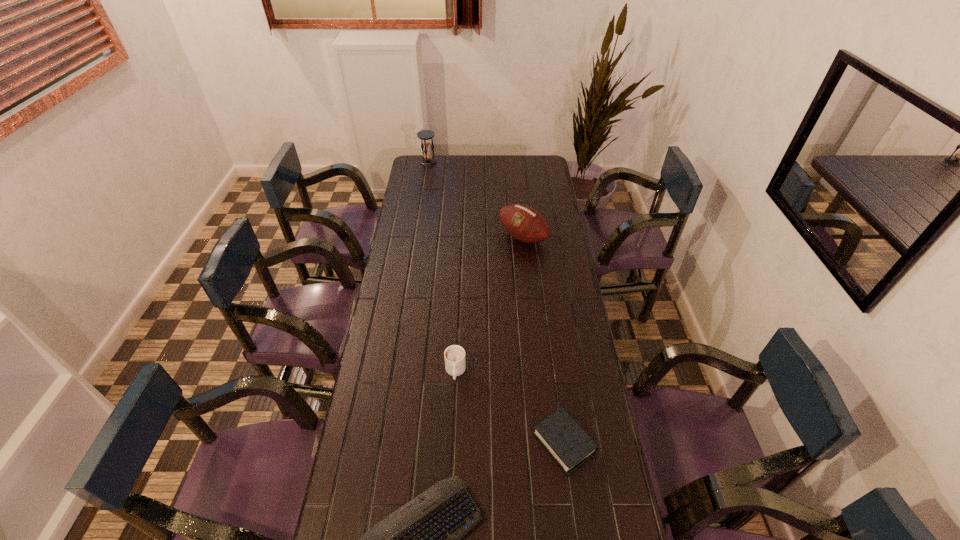
Where is `object located at the left edge`? The image size is (960, 540). object located at the left edge is located at coordinates (425, 135).

Image resolution: width=960 pixels, height=540 pixels. Identify the location of football (American) situated at the right edge. (524, 223).

This screenshot has height=540, width=960. What are the coordinates of `Bible that is at the right edge` in the screenshot? It's located at (570, 446).

Identify the location of object that is positioned at the far left corner. (425, 135).

This screenshot has height=540, width=960. In the image, there is a desktop. What are the coordinates of `free space at the far edge` in the screenshot? It's located at (497, 161).

Locate an element on the screen. The height and width of the screenshot is (540, 960). vacant space at the left edge of the desktop is located at coordinates (393, 407).

Where is `free space at the right edge of the desktop`? Image resolution: width=960 pixels, height=540 pixels. free space at the right edge of the desktop is located at coordinates (583, 318).

Identify the location of free space at the far left corner of the desktop. The width and height of the screenshot is (960, 540). (432, 172).

Identify the location of free space at the far right corner of the desktop. The width and height of the screenshot is (960, 540). (539, 156).

At what (x,y) coordinates should I click in order to perform the action: click on free area in between the farthest object and the fourth tallest object. Please return your answer as a coordinate pair (x, y). The height and width of the screenshot is (540, 960). Looking at the image, I should click on (496, 302).